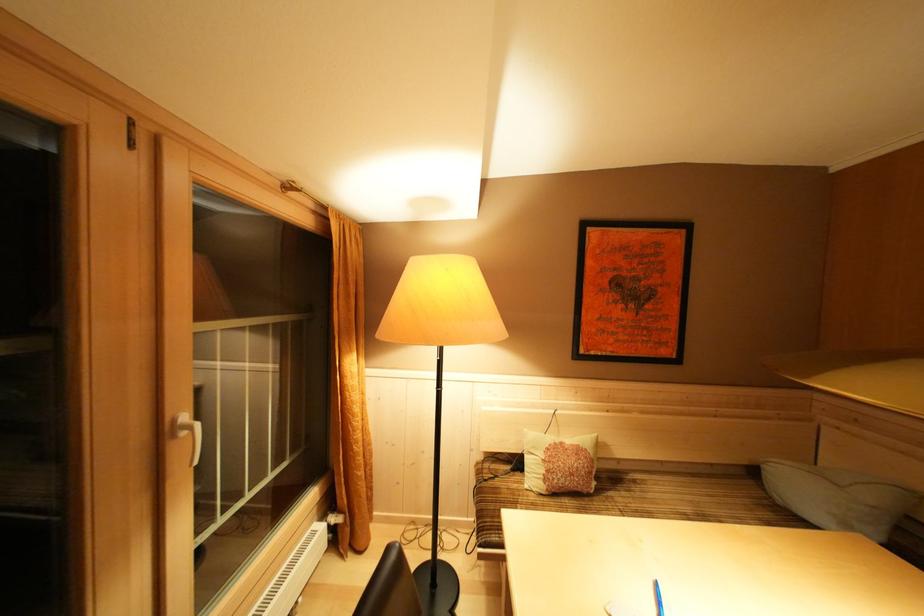
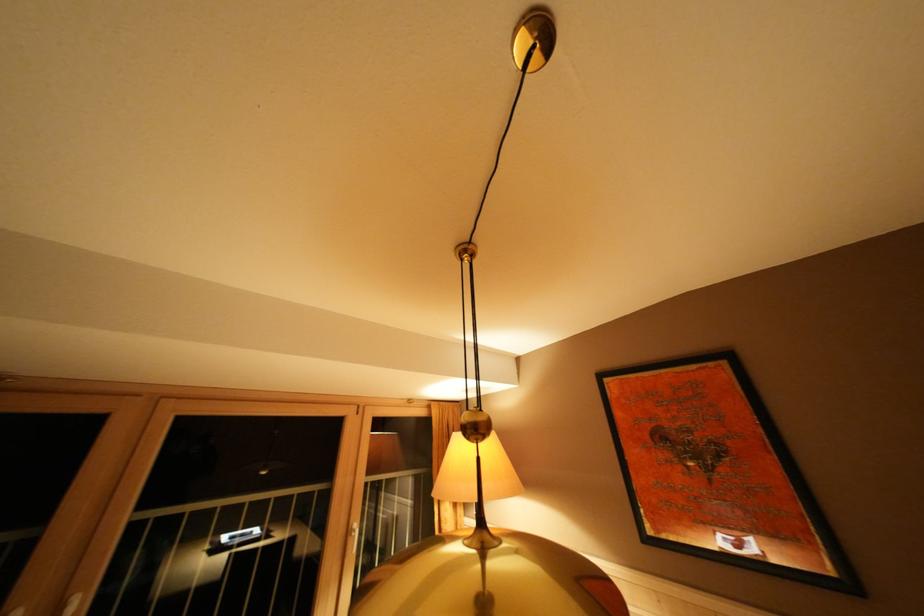
Locate, in the second image, the point that corresponds to point 169,440 in the first image.

(355, 537)